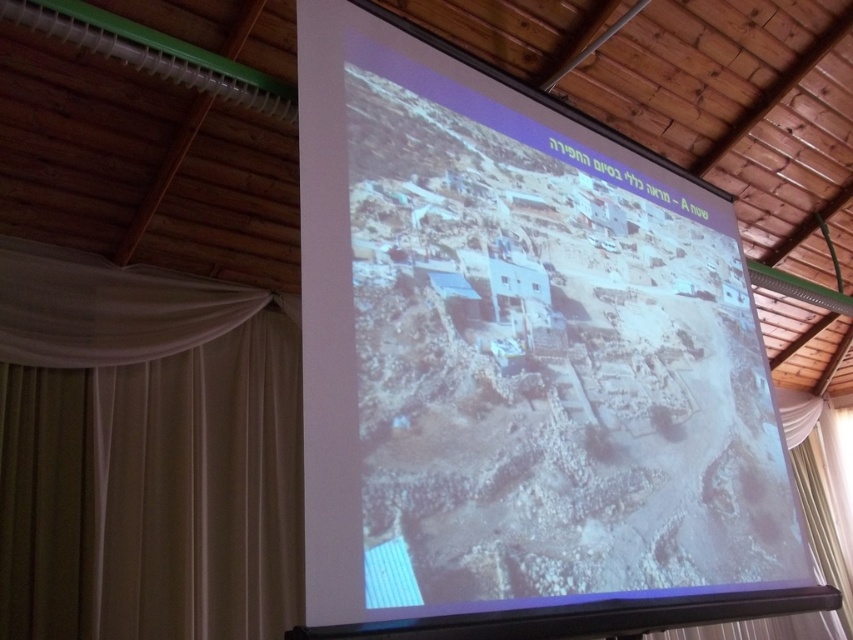
From the picture: Is gray stone wall at center closer to the viewer compared to beige fabric curtain at left?

Yes, gray stone wall at center is in front of beige fabric curtain at left.

Where is `gray stone wall at center`? This screenshot has height=640, width=853. gray stone wall at center is located at coordinates (520, 364).

Does point (706, 499) come farther from viewer compared to point (15, 513)?

No, (706, 499) is closer to viewer.

Identify the location of gray stone wall at center. (520, 364).

Is beige fabric curtain at left thinner than white sheer curtain at lower right?

Indeed, beige fabric curtain at left has a lesser width compared to white sheer curtain at lower right.

Based on the photo, who is positioned more to the right, beige fabric curtain at left or white sheer curtain at lower right?

white sheer curtain at lower right

Between point (97, 608) and point (677, 630), which one is positioned behind?

Point (677, 630)

Where is `beige fabric curtain at left`? Image resolution: width=853 pixels, height=640 pixels. beige fabric curtain at left is located at coordinates (144, 452).

From the picture: Between gray stone wall at center and white sheer curtain at lower right, which one has more height?

With more height is white sheer curtain at lower right.

Between point (368, 520) and point (723, 625), which one is positioned in front?

Positioned in front is point (368, 520).

Locate an element on the screen. The image size is (853, 640). gray stone wall at center is located at coordinates (520, 364).